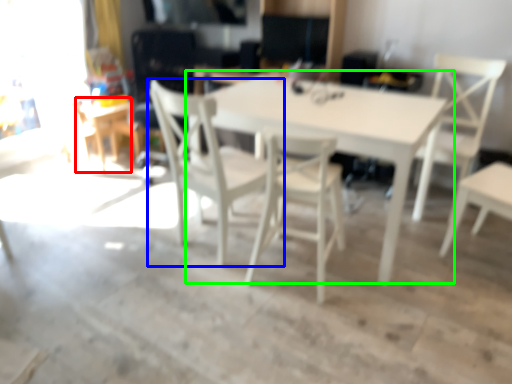
Question: Which object is the farthest from table (highlighted by a red box)? Choose among these: chair (highlighted by a blue box) or table (highlighted by a green box).

Choices:
 (A) chair
 (B) table

Answer: (B)